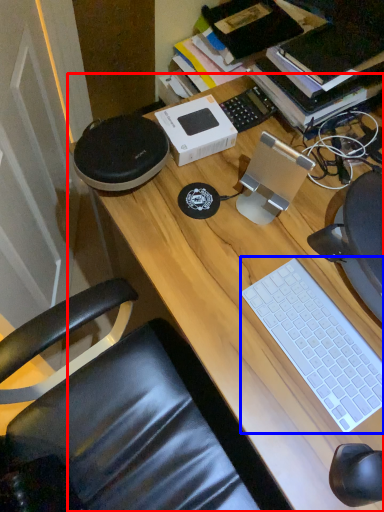
Question: Which point is further to the camera, desk (highlighted by a red box) or computer keyboard (highlighted by a blue box)?

Choices:
 (A) desk
 (B) computer keyboard

Answer: (B)